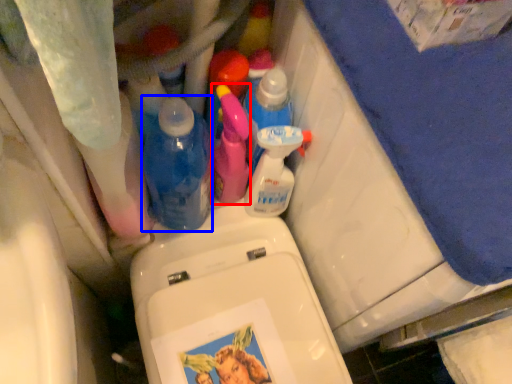
Question: Which object is further to the camera taking this photo, cleaning product (highlighted by a red box) or bottle (highlighted by a blue box)?

Choices:
 (A) cleaning product
 (B) bottle

Answer: (A)